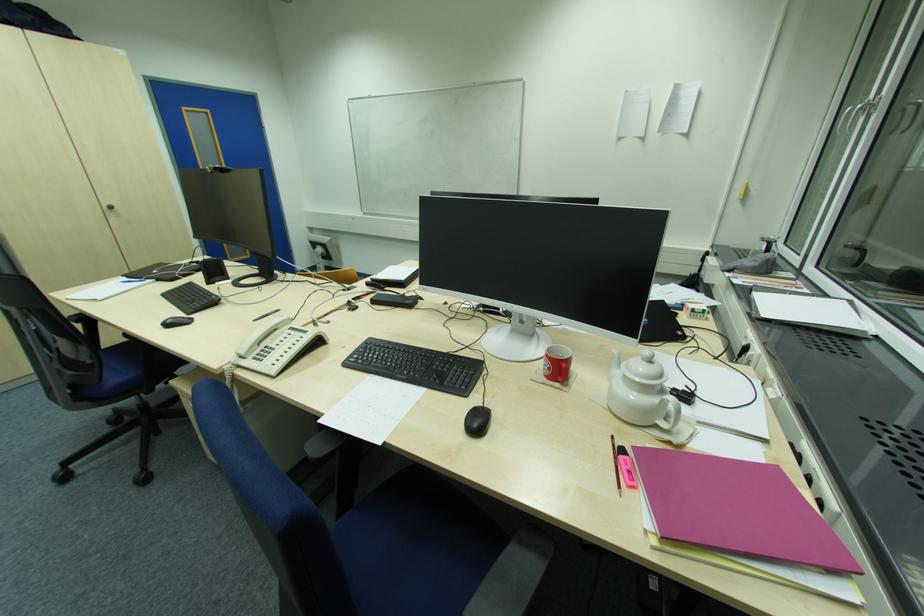
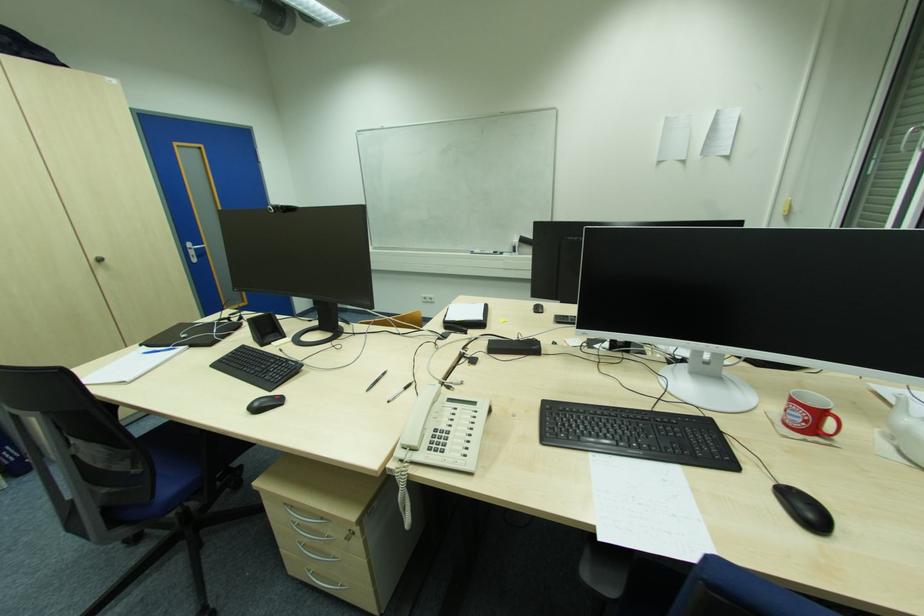
Which direction would the cameraman need to move to produce the second image?

Result: The movement direction of the cameraman is left, forward.